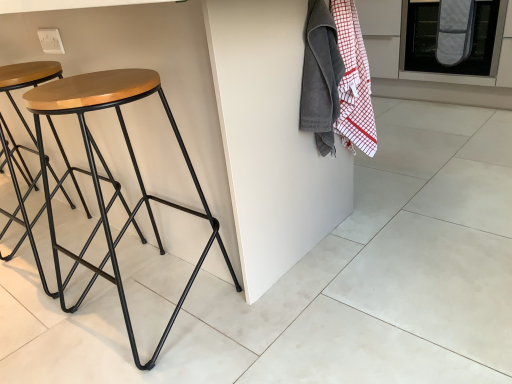
I want to click on free space to the right of woodenmaterial/texturestool at left, so click(277, 317).